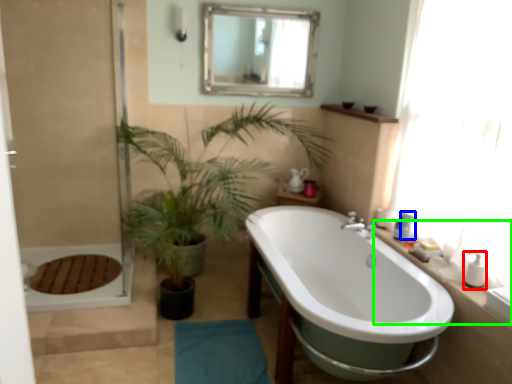
Question: Based on their relative distances, which object is nearer to toiletry (highlighted by a red box)? Choose from toiletry (highlighted by a blue box) and counter top (highlighted by a green box).

Choices:
 (A) toiletry
 (B) counter top

Answer: (B)